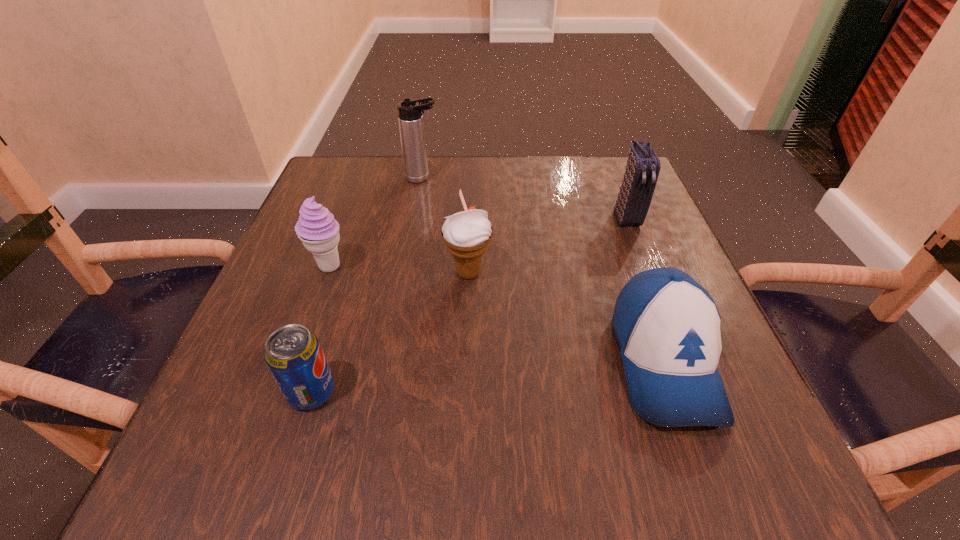
Image resolution: width=960 pixels, height=540 pixels. Identify the location of free spot that satisfies the following two spatial constraints: 1. on the handle side of the thermos bottle; 2. on the front side of the left icecream. (407, 267).

Locate an element on the screen. Image resolution: width=960 pixels, height=540 pixels. free point that satisfies the following two spatial constraints: 1. on the handle side of the third object from left to right; 2. on the left side of the right icecream is located at coordinates tap(406, 273).

Identify the location of free space that satisfies the following two spatial constraints: 1. on the handle side of the farthest object; 2. on the front side of the left icecream. The width and height of the screenshot is (960, 540). (407, 267).

The image size is (960, 540). Identify the location of free location that satisfies the following two spatial constraints: 1. on the handle side of the right icecream; 2. on the right side of the thermos bottle. (406, 273).